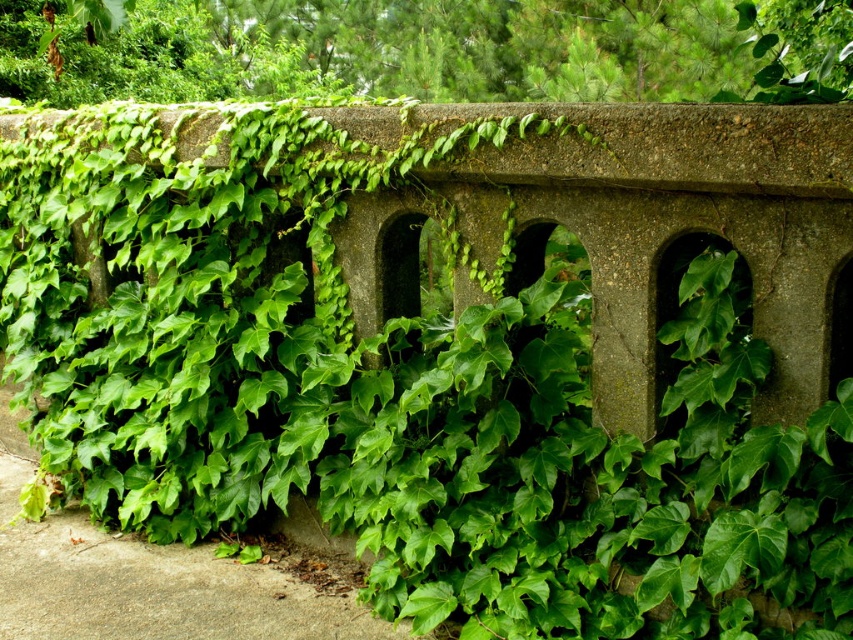
You are a gardener assessing the growth of the ivy on the railing. Which section of the ivy, the green leafy ivy at upper center or the green leafy ivy at lower left, has a wider spread?

The green leafy ivy at lower left has a wider spread than the green leafy ivy at upper center.

You are standing in a garden and see a concrete railing with ivy. There is a specific point marked at coordinates (427, 49). What object is located at that point?

The green leafy ivy at upper center is located at point (427, 49).

You are a gardener assessing the growth of ivy on a concrete railing. You notice two sections of green leafy ivy at upper center and green leafy ivy at lower left. Which section has shorter vines?

The green leafy ivy at upper center has shorter vines compared to the green leafy ivy at lower left.